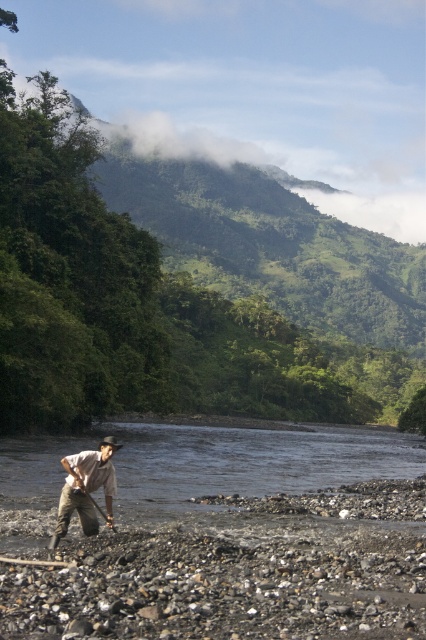
Can you confirm if light brown cotton shirt at lower left is smaller than shiny metallic shovel at lower center?

No.

Who is positioned more to the left, light brown cotton shirt at lower left or shiny metallic shovel at lower center?

light brown cotton shirt at lower left

Find the location of a particular element. The image size is (426, 640). light brown cotton shirt at lower left is located at coordinates (86, 488).

The height and width of the screenshot is (640, 426). Identify the location of light brown cotton shirt at lower left. [86, 488].